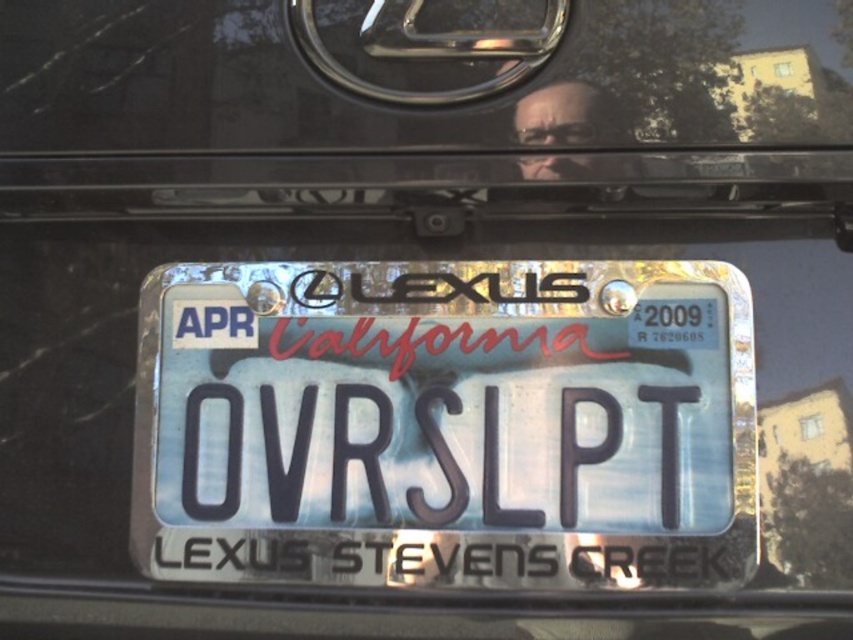
Who is more distant from viewer, (642, 385) or (346, 3)?

Point (346, 3)

Does metallic reflective license plate at center lie in front of transparent glass at center?

That is False.

Which is behind, point (520, 326) or point (78, 216)?

The point (78, 216) is behind.

You are a GUI agent. You are given a task and a screenshot of the screen. Output one action in this format:
    pyautogui.click(x=<x>, y=<y>)
    Task: Click on the metallic reflective license plate at center
    The width and height of the screenshot is (853, 640).
    Given the screenshot: What is the action you would take?
    pyautogui.click(x=445, y=424)